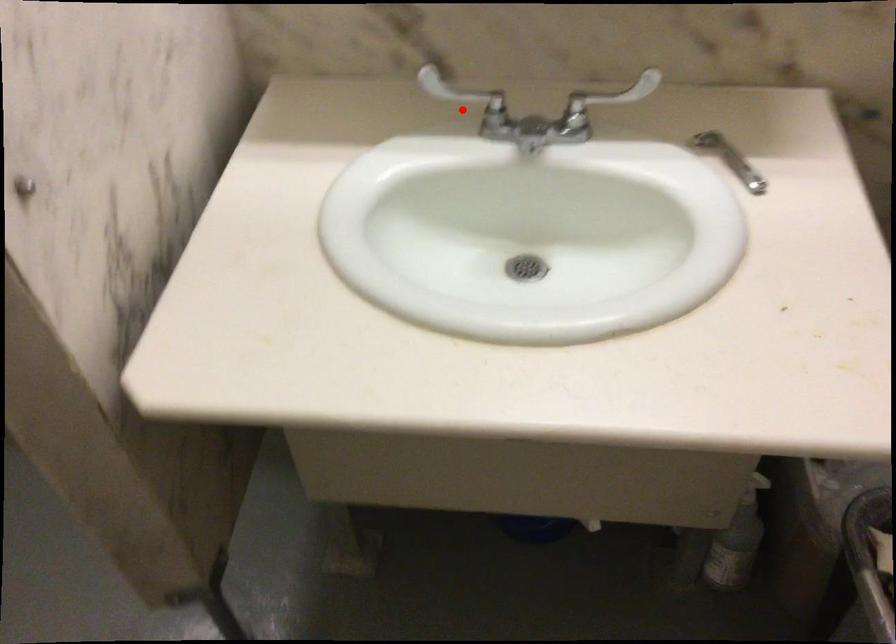
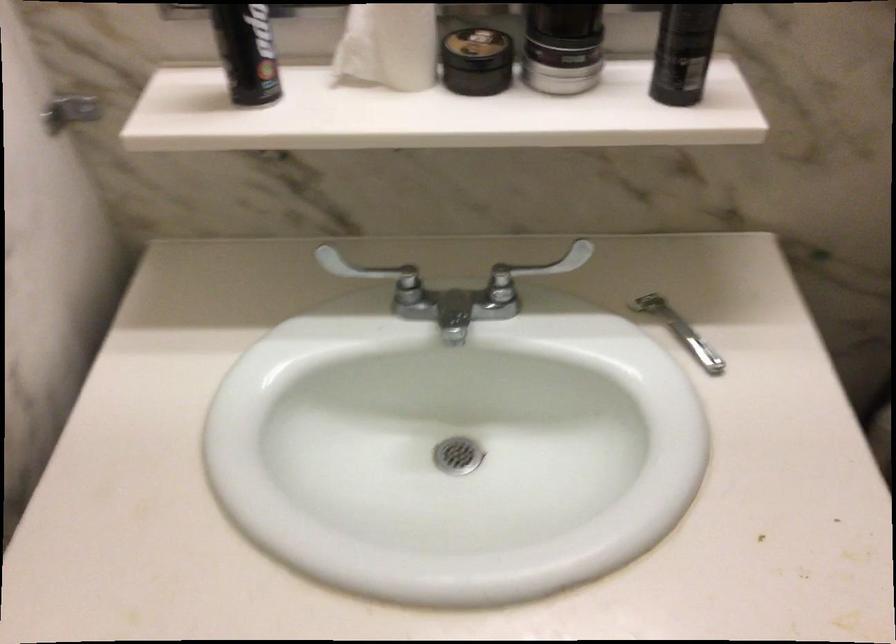
Find the pixel in the second image that matches the highlighted location in the first image.

(375, 275)